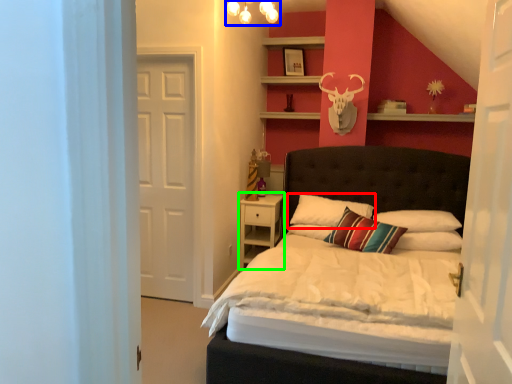
Question: Which object is the farthest from pillow (highlighted by a red box)? Choose among these: light fixture (highlighted by a blue box) or nightstand (highlighted by a green box).

Choices:
 (A) light fixture
 (B) nightstand

Answer: (A)